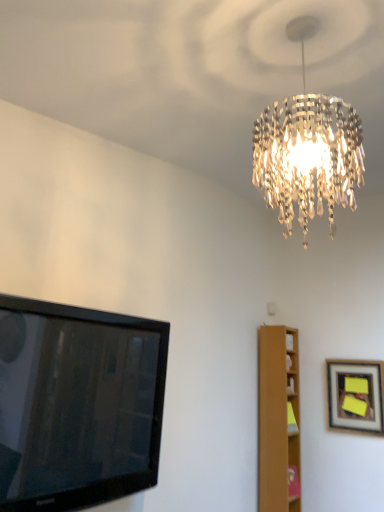
In order to click on wooden framed picture at right in this screenshot , I will do (355, 395).

Describe the element at coordinates (355, 395) in the screenshot. I see `wooden framed picture at right` at that location.

This screenshot has width=384, height=512. What are the coordinates of `black glossy tv at left` in the screenshot? It's located at (77, 405).

Between wooden framed picture at right and black glossy tv at left, which one has more height?

black glossy tv at left.

Which is in front, point (361, 362) or point (12, 385)?

Positioned in front is point (361, 362).

From a real-world perspective, between wooden framed picture at right and black glossy tv at left, who is vertically higher?

wooden framed picture at right is physically above.

Who is bigger, wooden framed picture at right or black glossy tv at left?

black glossy tv at left.

Which of these two, black glossy tv at left or wooden framed picture at right, stands shorter?

With less height is wooden framed picture at right.

Is the position of black glossy tv at left less distant than that of wooden framed picture at right?

Yes, black glossy tv at left is closer to the viewer.

From the image's perspective, which is below, black glossy tv at left or wooden framed picture at right?

wooden framed picture at right is shown below in the image.

From a real-world perspective, who is located lower, black glossy tv at left or light brown wooden bookshelf at right?

light brown wooden bookshelf at right.

Who is bigger, black glossy tv at left or light brown wooden bookshelf at right?

With larger size is black glossy tv at left.

Between point (290, 426) and point (73, 504), which one is positioned behind?

Point (290, 426)

Considering the relative positions of light brown wooden bookshelf at right and black glossy tv at left in the image provided, is light brown wooden bookshelf at right to the left of black glossy tv at left from the viewer's perspective?

Incorrect, light brown wooden bookshelf at right is not on the left side of black glossy tv at left.

How many degrees apart are the facing directions of light brown wooden bookshelf at right and black glossy tv at left?

There is a 1.96-degree angle between the facing directions of light brown wooden bookshelf at right and black glossy tv at left.

Does light brown wooden bookshelf at right have a lesser height compared to black glossy tv at left?

No.

Who is smaller, wooden framed picture at right or light brown wooden bookshelf at right?

wooden framed picture at right.

This screenshot has height=512, width=384. In order to click on furniture lying on the left of wooden framed picture at right in this screenshot , I will do 278,420.

Considering the sizes of wooden framed picture at right and light brown wooden bookshelf at right in the image, is wooden framed picture at right wider or thinner than light brown wooden bookshelf at right?

Clearly, wooden framed picture at right has less width compared to light brown wooden bookshelf at right.

From the image's perspective, is wooden framed picture at right under light brown wooden bookshelf at right?

Actually, wooden framed picture at right appears above light brown wooden bookshelf at right in the image.

What's the angular difference between light brown wooden bookshelf at right and wooden framed picture at right's facing directions?

There is a 89.8-degree angle between the facing directions of light brown wooden bookshelf at right and wooden framed picture at right.

Is light brown wooden bookshelf at right shorter than wooden framed picture at right?

In fact, light brown wooden bookshelf at right may be taller than wooden framed picture at right.

From the image's perspective, would you say light brown wooden bookshelf at right is shown under wooden framed picture at right?

Indeed, from the image's perspective, light brown wooden bookshelf at right is shown beneath wooden framed picture at right.

Is light brown wooden bookshelf at right far from wooden framed picture at right?

No, light brown wooden bookshelf at right is not far away from wooden framed picture at right.

The image size is (384, 512). Find the location of `television below the wooden framed picture at right (from a real-world perspective)`. television below the wooden framed picture at right (from a real-world perspective) is located at coordinates [77, 405].

You are a GUI agent. You are given a task and a screenshot of the screen. Output one action in this format:
    pyautogui.click(x=<x>, y=<y>)
    Task: Click on the television in front of the wooden framed picture at right
    
    Given the screenshot: What is the action you would take?
    pyautogui.click(x=77, y=405)

Estimate the real-world distances between objects in this image. Which object is further from light brown wooden bookshelf at right, wooden framed picture at right or black glossy tv at left?

black glossy tv at left lies further to light brown wooden bookshelf at right than the other object.

Consider the image. When comparing their distances from black glossy tv at left, does light brown wooden bookshelf at right or wooden framed picture at right seem further?

wooden framed picture at right is positioned further to the anchor black glossy tv at left.

Looking at the image, which one is located closer to black glossy tv at left, wooden framed picture at right or light brown wooden bookshelf at right?

Among the two, light brown wooden bookshelf at right is located nearer to black glossy tv at left.

Looking at the image, which one is located further to wooden framed picture at right, light brown wooden bookshelf at right or black glossy tv at left?

A: black glossy tv at left is further to wooden framed picture at right.

From the image, which object appears to be nearer to wooden framed picture at right, black glossy tv at left or light brown wooden bookshelf at right?

Among the two, light brown wooden bookshelf at right is located nearer to wooden framed picture at right.

Which object lies further to the anchor point light brown wooden bookshelf at right, black glossy tv at left or wooden framed picture at right?

The object further to light brown wooden bookshelf at right is black glossy tv at left.

You are a GUI agent. You are given a task and a screenshot of the screen. Output one action in this format:
    pyautogui.click(x=<x>, y=<y>)
    Task: Click on the picture frame between black glossy tv at left and light brown wooden bookshelf at right along the z-axis
    
    Given the screenshot: What is the action you would take?
    pyautogui.click(x=355, y=395)